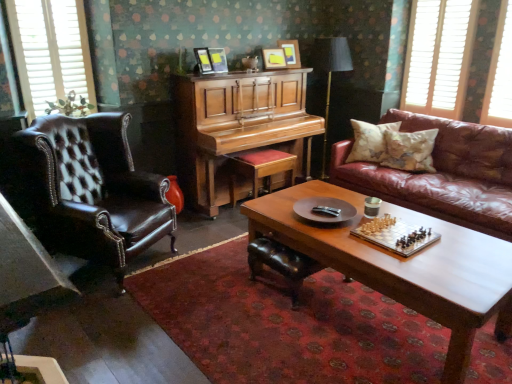
Where is `vacant point above metallic chess set at center (from a real-world perspective)`? This screenshot has width=512, height=384. vacant point above metallic chess set at center (from a real-world perspective) is located at coordinates (395, 235).